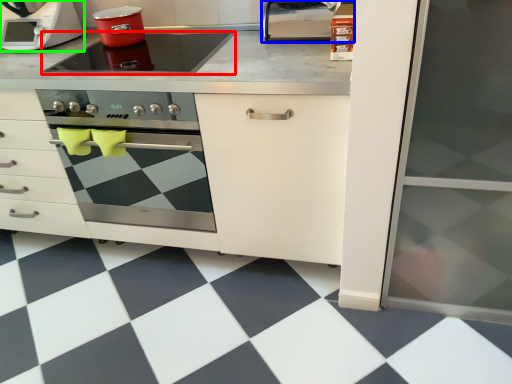
Question: Which object is the farthest from kitchen appliance (highlighted by a red box)? Choose among these: appliance (highlighted by a blue box) or home appliance (highlighted by a green box).

Choices:
 (A) appliance
 (B) home appliance

Answer: (A)